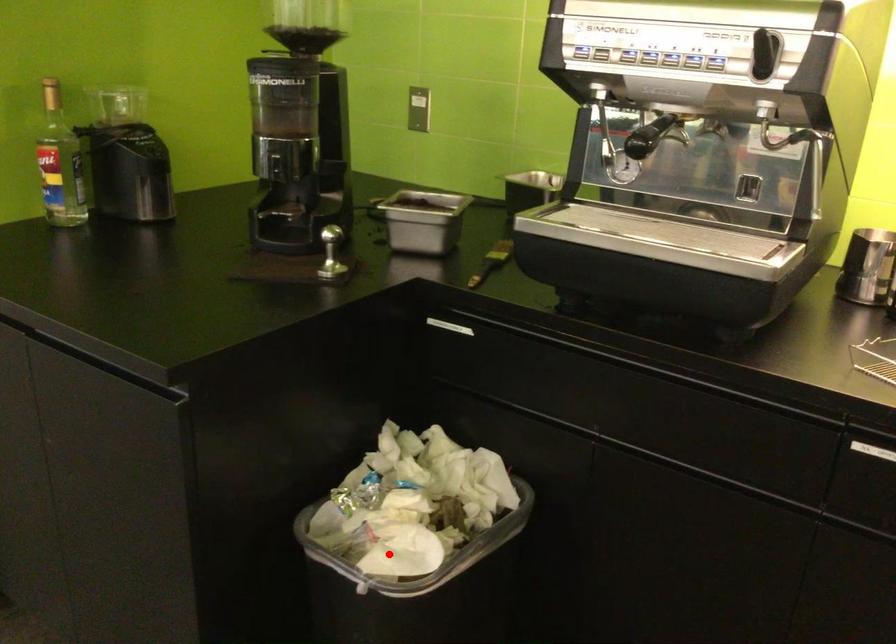
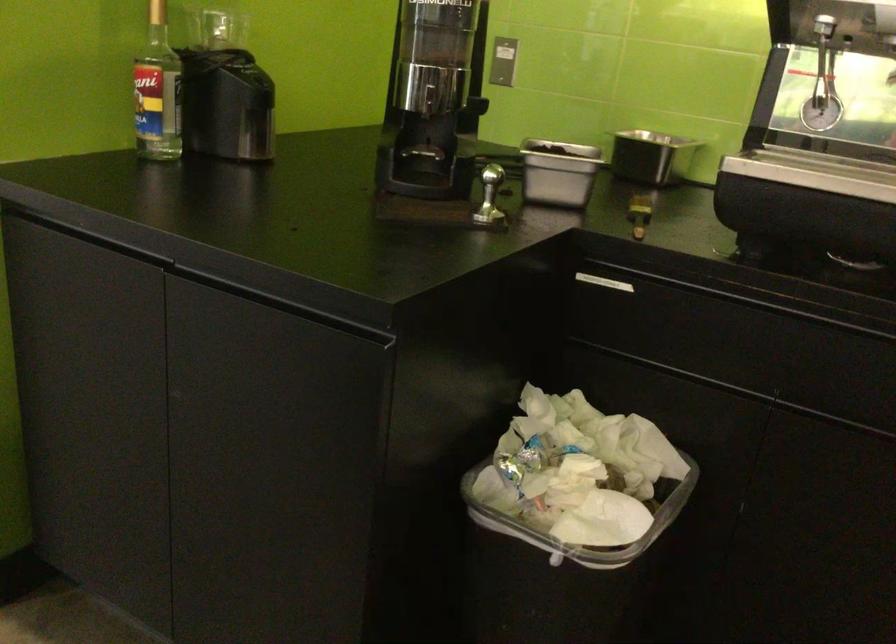
Question: I am providing you with two images of the same scene from different viewpoints. Given a red point in image1, look at the same physical point in image2. Is it:

Choices:
 (A) Closer to the viewpoint
 (B) Farther from the viewpoint

Answer: (A)